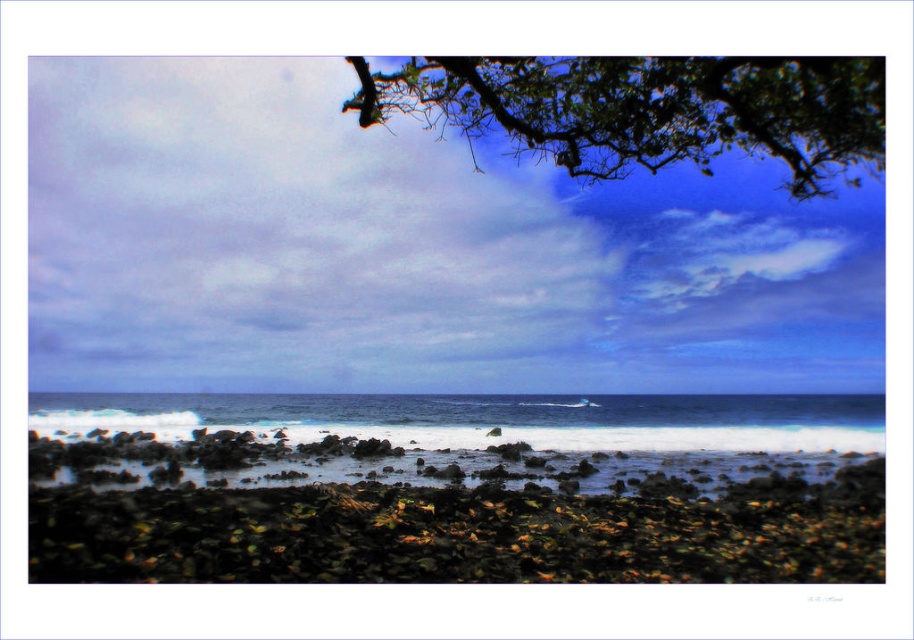
What do you see at coordinates (443, 438) in the screenshot? I see `white frothy water at center` at bounding box center [443, 438].

Measure the distance between white frothy water at center and camera.

white frothy water at center and camera are 16.00 meters apart.

Where is `white frothy water at center`? This screenshot has height=640, width=914. white frothy water at center is located at coordinates (443, 438).